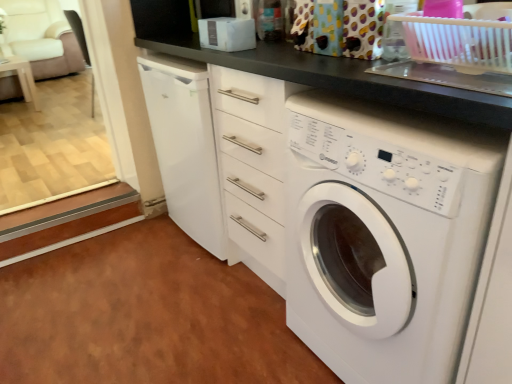
Question: Is pink plastic basket at upper right inside white glossy table at left?

Choices:
 (A) yes
 (B) no

Answer: (B)

Question: Is white glossy table at left bigger than pink plastic basket at upper right?

Choices:
 (A) no
 (B) yes

Answer: (B)

Question: From a real-world perspective, is white glossy table at left located higher than pink plastic basket at upper right?

Choices:
 (A) yes
 (B) no

Answer: (B)

Question: Does white glossy table at left appear on the right side of pink plastic basket at upper right?

Choices:
 (A) no
 (B) yes

Answer: (A)

Question: Does white glossy table at left appear on the left side of pink plastic basket at upper right?

Choices:
 (A) no
 (B) yes

Answer: (B)

Question: Is white glossy table at left beside pink plastic basket at upper right?

Choices:
 (A) no
 (B) yes

Answer: (A)

Question: Can you confirm if white fabric armchair at upper left is taller than white glossy table at left?

Choices:
 (A) no
 (B) yes

Answer: (B)

Question: Can you confirm if white fabric armchair at upper left is positioned to the right of white glossy table at left?

Choices:
 (A) yes
 (B) no

Answer: (B)

Question: Can you confirm if white fabric armchair at upper left is shorter than white glossy table at left?

Choices:
 (A) no
 (B) yes

Answer: (A)

Question: From a real-world perspective, is white fabric armchair at upper left on white glossy table at left?

Choices:
 (A) no
 (B) yes

Answer: (B)

Question: Is white fabric armchair at upper left not close to white glossy table at left?

Choices:
 (A) no
 (B) yes

Answer: (A)

Question: Is white fabric armchair at upper left located outside white glossy table at left?

Choices:
 (A) yes
 (B) no

Answer: (A)

Question: Is white glossy washing machine at center directly adjacent to white fabric armchair at upper left?

Choices:
 (A) no
 (B) yes

Answer: (A)